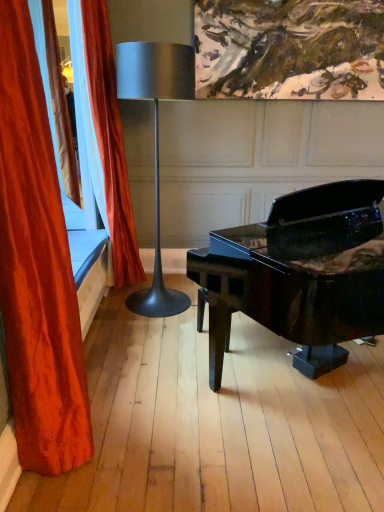
Question: Is velvet orange curtain at left, positioned as the 1th curtain in back-to-front order, positioned with its back to metallic silver lamp at center?

Choices:
 (A) yes
 (B) no

Answer: (A)

Question: Is velvet orange curtain at left, positioned as the 1th curtain in back-to-front order, behind metallic silver lamp at center?

Choices:
 (A) no
 (B) yes

Answer: (B)

Question: Considering the relative sizes of velvet orange curtain at left, positioned as the 1th curtain in back-to-front order, and metallic silver lamp at center in the image provided, is velvet orange curtain at left, positioned as the 1th curtain in back-to-front order, bigger than metallic silver lamp at center?

Choices:
 (A) no
 (B) yes

Answer: (A)

Question: From a real-world perspective, is velvet orange curtain at left, marked as the 2th curtain in a front-to-back arrangement, positioned over metallic silver lamp at center based on gravity?

Choices:
 (A) yes
 (B) no

Answer: (A)

Question: Is velvet orange curtain at left, marked as the 2th curtain in a front-to-back arrangement, closer to the viewer compared to metallic silver lamp at center?

Choices:
 (A) no
 (B) yes

Answer: (A)

Question: Does velvet orange curtain at left, positioned as the 1th curtain in back-to-front order, appear on the left side of metallic silver lamp at center?

Choices:
 (A) yes
 (B) no

Answer: (A)

Question: Is glossy black piano at center turned away from velvet orange curtain at left, marked as the 2th curtain in a front-to-back arrangement?

Choices:
 (A) yes
 (B) no

Answer: (A)

Question: Is glossy black piano at center at the left side of velvet orange curtain at left, positioned as the 1th curtain in back-to-front order?

Choices:
 (A) yes
 (B) no

Answer: (B)

Question: From the image's perspective, is glossy black piano at center over velvet orange curtain at left, marked as the 2th curtain in a front-to-back arrangement?

Choices:
 (A) yes
 (B) no

Answer: (B)

Question: Can you confirm if glossy black piano at center is smaller than velvet orange curtain at left, positioned as the 1th curtain in back-to-front order?

Choices:
 (A) yes
 (B) no

Answer: (B)

Question: From a real-world perspective, is glossy black piano at center positioned over velvet orange curtain at left, positioned as the 1th curtain in back-to-front order, based on gravity?

Choices:
 (A) no
 (B) yes

Answer: (A)

Question: Considering the relative positions of glossy black piano at center and velvet orange curtain at left, positioned as the 1th curtain in back-to-front order, in the image provided, is glossy black piano at center behind velvet orange curtain at left, positioned as the 1th curtain in back-to-front order,?

Choices:
 (A) no
 (B) yes

Answer: (A)

Question: Is velvet red curtain at left, the 1th curtain positioned from the front, thinner than metallic silver lamp at center?

Choices:
 (A) yes
 (B) no

Answer: (A)